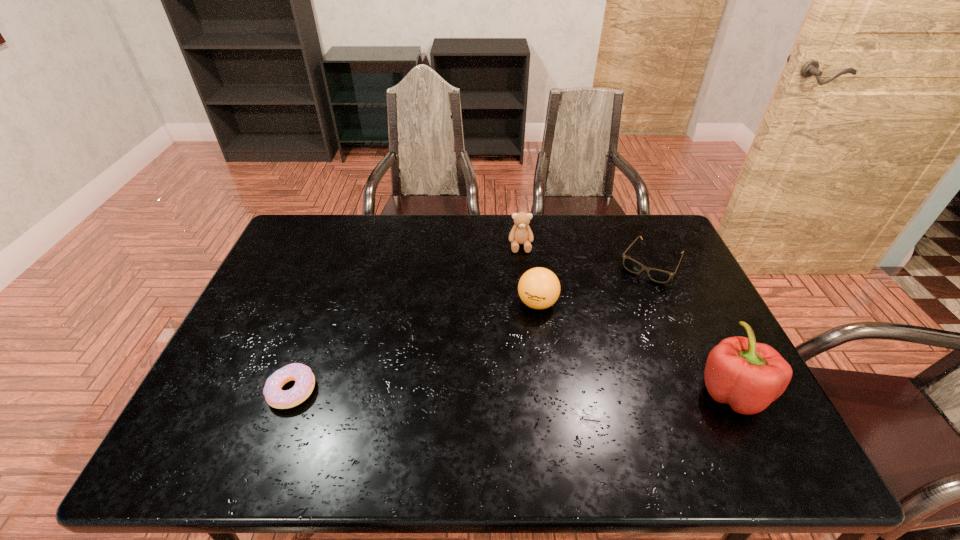
What are the coordinates of `object that can be found as the fourth closest to the sunglasses` in the screenshot? It's located at (304, 379).

The image size is (960, 540). I want to click on object that is the fourth closest one to the tallest object, so click(x=304, y=379).

Find the location of a particular element. free space that satisfies the following two spatial constraints: 1. on the front side of the bell pepper; 2. on the right side of the sunglasses is located at coordinates (708, 391).